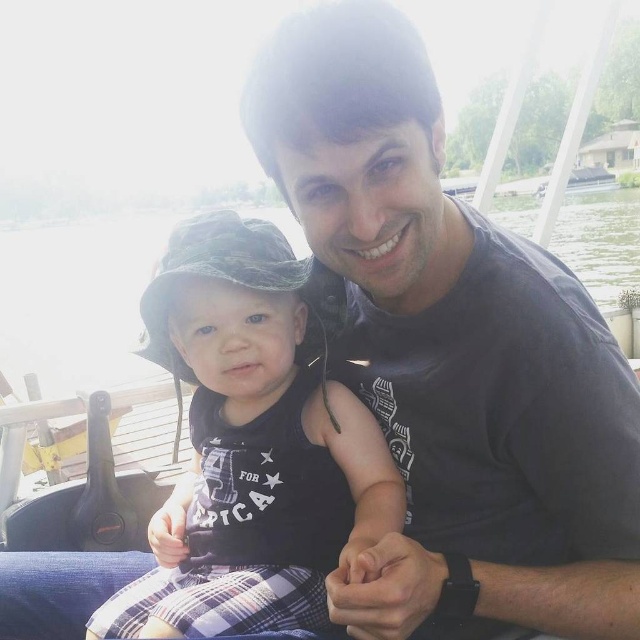
In the scene shown: Between camouflage fabric hat at left and transparent water at center, which one has less height?

camouflage fabric hat at left

Does camouflage fabric hat at left have a smaller size compared to transparent water at center?

Correct, camouflage fabric hat at left occupies less space than transparent water at center.

The height and width of the screenshot is (640, 640). I want to click on camouflage fabric hat at left, so click(253, 444).

Where is `camouflage fabric hat at left`? Image resolution: width=640 pixels, height=640 pixels. camouflage fabric hat at left is located at coordinates (253, 444).